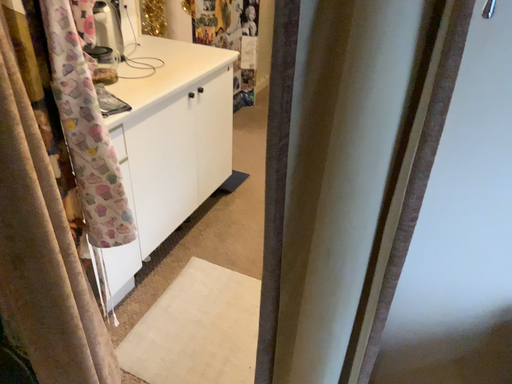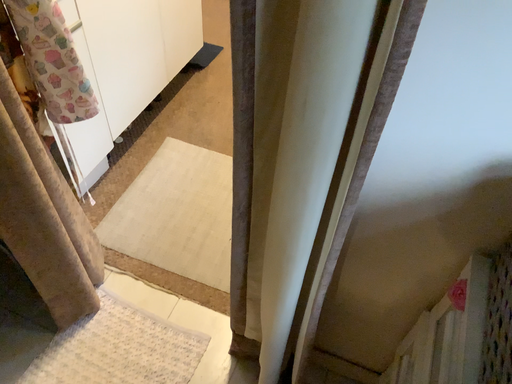
Question: Which way did the camera rotate in the video?

Choices:
 (A) rotated upward
 (B) rotated downward

Answer: (B)